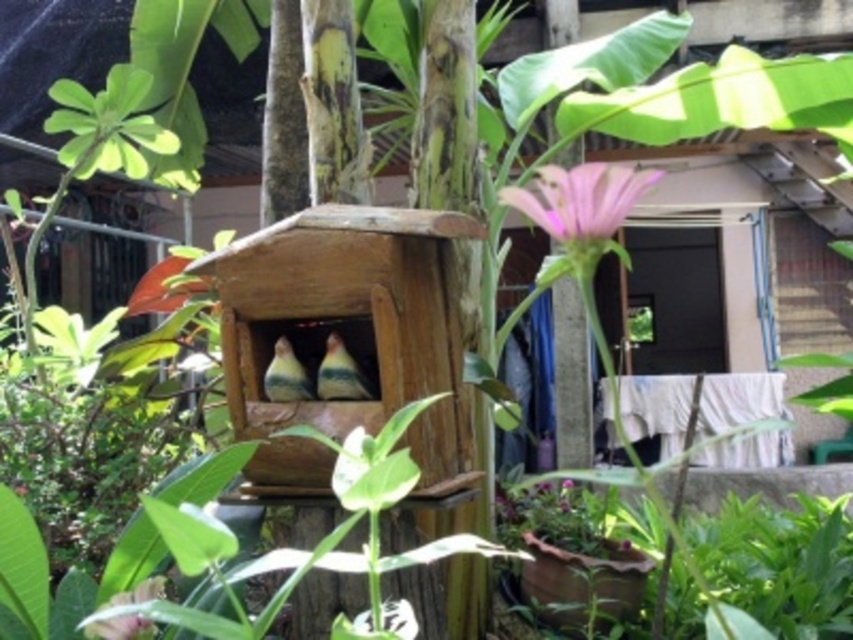
Question: Among these objects, which one is farthest from the camera?

Choices:
 (A) wooden bird feeder at center
 (B) green matte flower at lower left
 (C) pink matte flower at upper center

Answer: (C)

Question: Which object appears closest to the camera in this image?

Choices:
 (A) pink matte flower at upper center
 (B) wooden bird feeder at center
 (C) green matte bird at center

Answer: (B)

Question: Among these objects, which one is farthest from the camera?

Choices:
 (A) green matte bird at center
 (B) pink matte flower at upper center

Answer: (B)

Question: Is wooden bird feeder at center to the right of multicolored feathered bird at center from the viewer's perspective?

Choices:
 (A) no
 (B) yes

Answer: (B)

Question: Does pink matte flower at upper center lie behind green matte bird at center?

Choices:
 (A) yes
 (B) no

Answer: (A)

Question: Is pink matte flower at upper center above green matte flower at lower left?

Choices:
 (A) no
 (B) yes

Answer: (B)